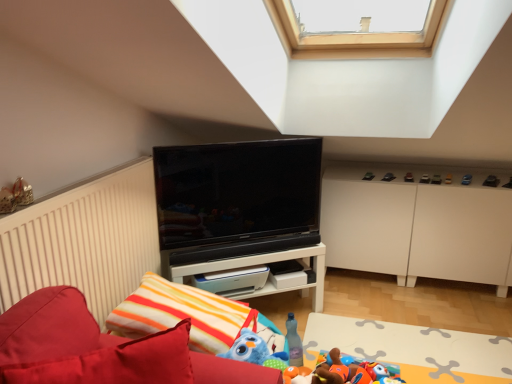
Where is `free space to the left of metallic black toy car at upper right, the first toy viewed from the right`? The height and width of the screenshot is (384, 512). free space to the left of metallic black toy car at upper right, the first toy viewed from the right is located at coordinates (474, 178).